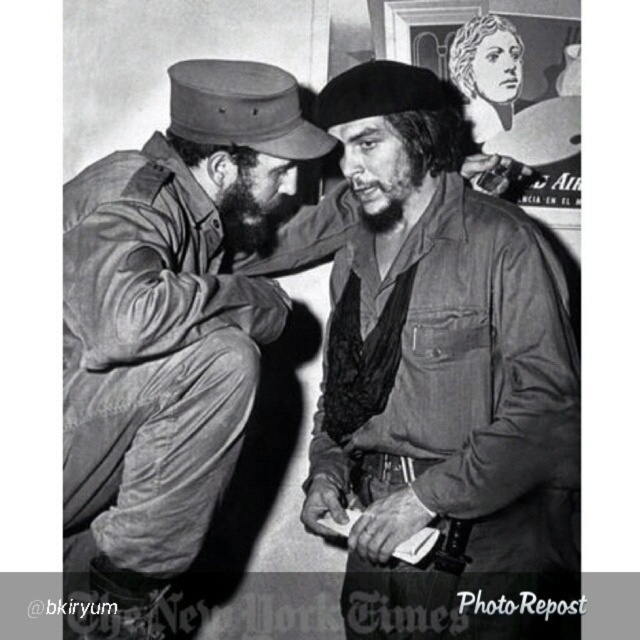
You are a photographer who wants to focus on the dark brown leather jacket at center in this black and white photo. What coordinates should you adjust your camera to aim at?

The dark brown leather jacket at center is located at coordinates point [442,380], so you should adjust your camera to aim at those coordinates to focus on it.

You are a photographer reviewing this image. You want to know which of the two points, point (413, 500) or point (224, 316), is nearer to your camera position. Which one is closer?

Point (413, 500) is closer to the camera than point (224, 316).